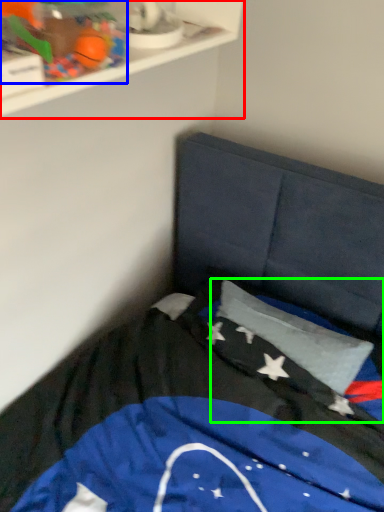
Question: Which object is the closest to the shelf (highlighted by a red box)? Choose among these: toy (highlighted by a blue box) or flag (highlighted by a green box).

Choices:
 (A) toy
 (B) flag

Answer: (A)